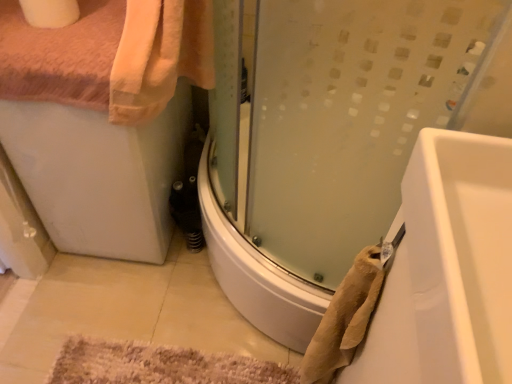
Locate an element on the screen. vacant space behind beige textured bath mat at lower center is located at coordinates (176, 299).